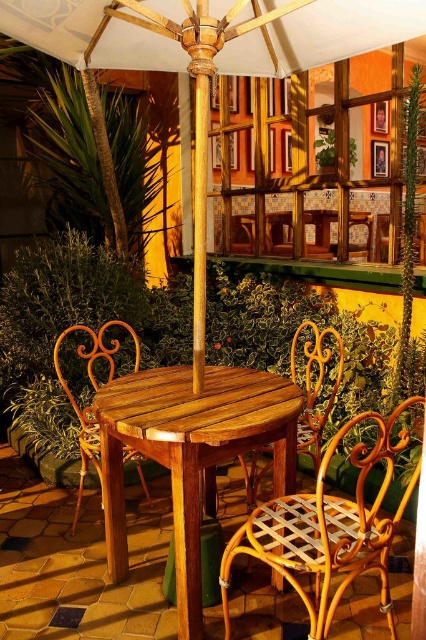
Question: Which object appears farthest from the camera in this image?

Choices:
 (A) rattan chair at center
 (B) teak wood table at center
 (C) wooden wicker chair at left

Answer: (A)

Question: Does teak wood table at center have a lesser width compared to wooden wicker chair at left?

Choices:
 (A) yes
 (B) no

Answer: (B)

Question: Estimate the real-world distances between objects in this image. Which object is farther from the rattan chair at center?

Choices:
 (A) teak wood table at center
 (B) light brown woven wood chair at lower right

Answer: (B)

Question: Estimate the real-world distances between objects in this image. Which object is farther from the teak wood table at center?

Choices:
 (A) rattan chair at center
 (B) light brown woven wood chair at lower right
 (C) wooden wicker chair at left

Answer: (A)

Question: Can you confirm if rattan chair at center is thinner than wooden wicker chair at left?

Choices:
 (A) no
 (B) yes

Answer: (B)

Question: Can you confirm if light brown woven wood chair at lower right is smaller than rattan chair at center?

Choices:
 (A) yes
 (B) no

Answer: (A)